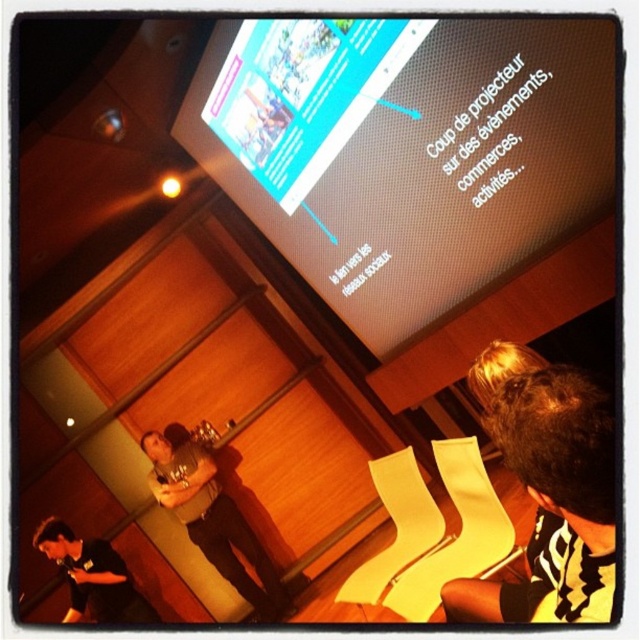
You are an event planner standing in the conference room and want to place a new poster on the wall. The poster has a pin at point (406, 150). Where should you place the pin so that it aligns with the existing screen?

The point (406, 150) is on the matte black screen at upper center, so you should place the pin on the matte black screen at upper center to align with the existing screen.

You are an event photographer who needs to capture a photo of the matte black screen at upper center and the brown leather jacket at lower left. Based on their positions, which object should you focus on first to ensure both are in frame?

The matte black screen at upper center is positioned on the right side of brown leather jacket at lower left, so you should focus on the brown leather jacket at lower left first to ensure both are in frame.